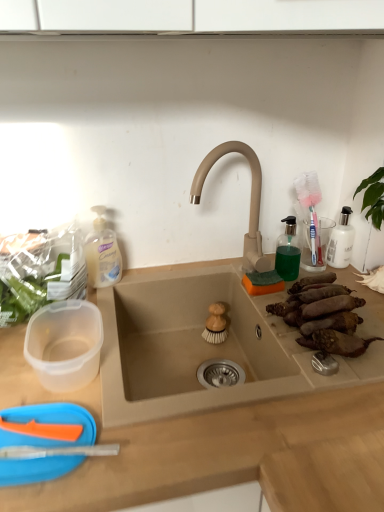
At what (x,y) coordinates should I click in order to perform the action: click on free space in front of brown rough sweet potatoes at right sink, acting as the second food starting from the left. Please return your answer as a coordinate pair (x, y). This screenshot has height=512, width=384. Looking at the image, I should click on (314, 378).